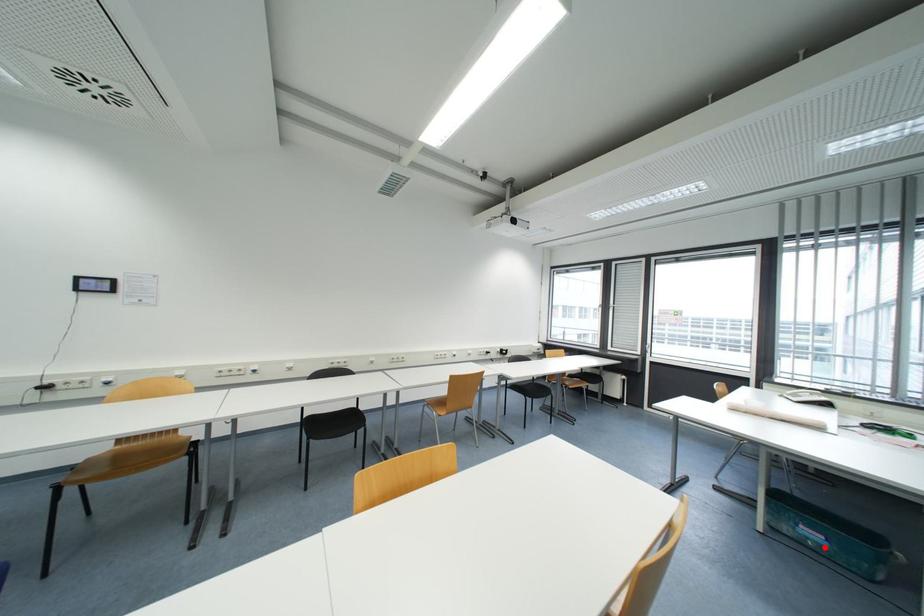
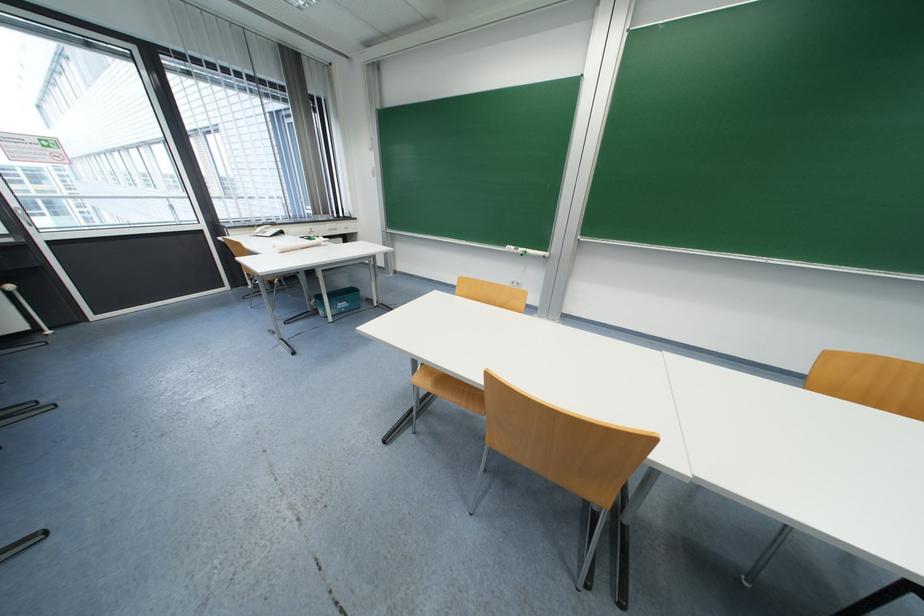
Question: A red point is marked in image1. In image2, is the corresponding 3D point closer to the camera or farther? Reply with the corresponding letter.

Choices:
 (A) The corresponding 3D point is closer.
 (B) The corresponding 3D point is farther.

Answer: (B)